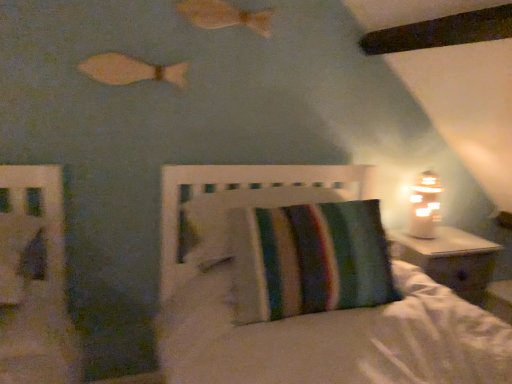
In order to click on free space in front of white frosted glass table lamp at right in this screenshot , I will do `click(435, 248)`.